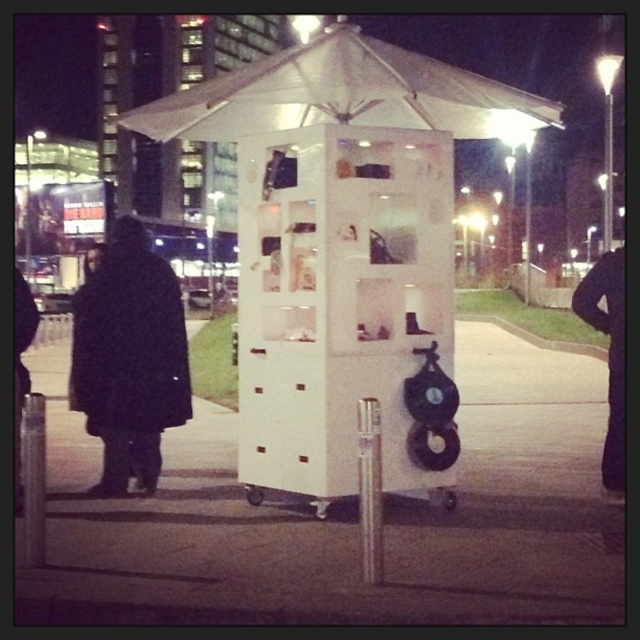
Question: Which object is closer to the camera taking this photo?

Choices:
 (A) black matte coat at left
 (B) white matte cart at center
 (C) white fabric canopy at upper center
 (D) white matte gazebo at center

Answer: (B)

Question: Can you confirm if white matte gazebo at center is wider than white fabric canopy at upper center?

Choices:
 (A) no
 (B) yes

Answer: (A)

Question: Which point appears farthest from the camera in this image?

Choices:
 (A) (248, 115)
 (B) (243, 365)
 (C) (426, 561)

Answer: (A)

Question: Is white fabric canopy at upper center in front of black matte coat at left?

Choices:
 (A) no
 (B) yes

Answer: (B)

Question: Which point is closer to the camera?

Choices:
 (A) (381, 120)
 (B) (252, 83)
 (C) (166, 408)
 (D) (404, 552)

Answer: (D)

Question: Does white matte cart at center appear under black matte coat at left?

Choices:
 (A) no
 (B) yes

Answer: (B)